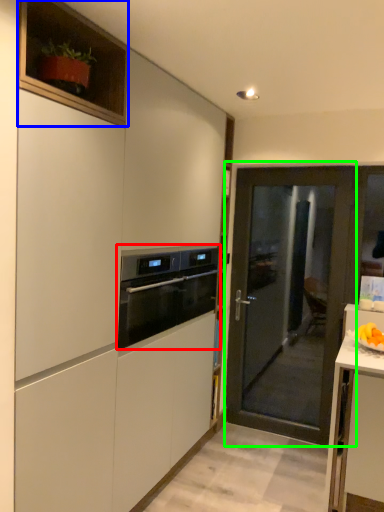
Question: Which is farther away from kitchen appliance (highlighted by a red box)? cabinetry (highlighted by a blue box) or door (highlighted by a green box)?

Choices:
 (A) cabinetry
 (B) door

Answer: (B)